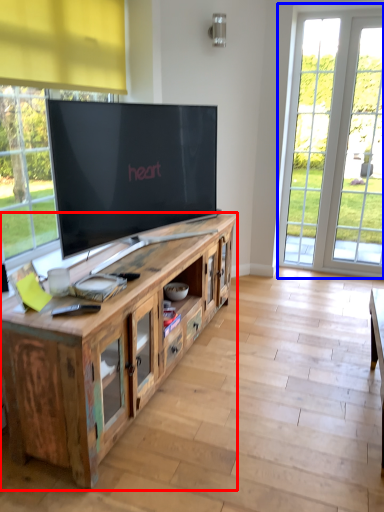
Question: Among these objects, which one is farthest to the camera, cabinetry (highlighted by a red box) or window (highlighted by a blue box)?

Choices:
 (A) cabinetry
 (B) window

Answer: (B)